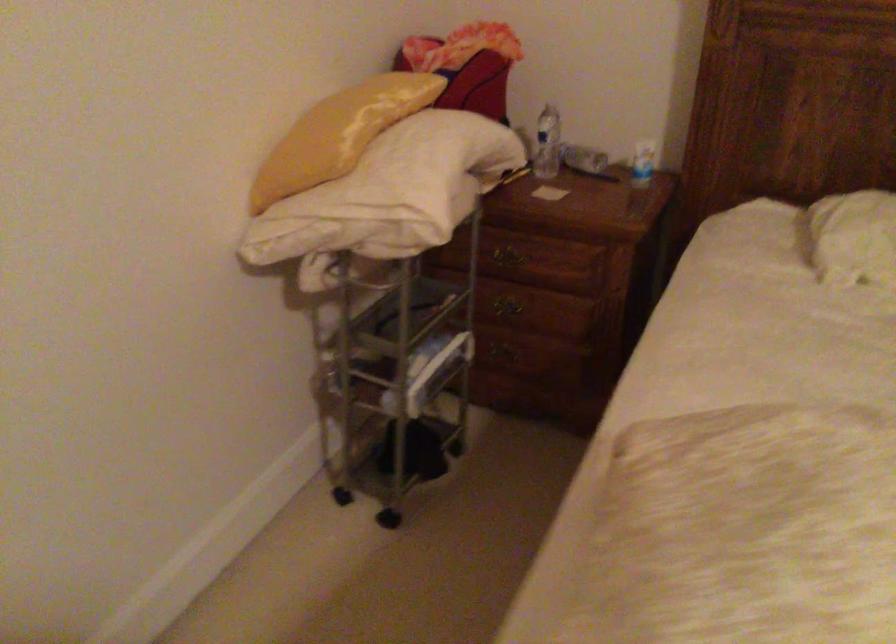
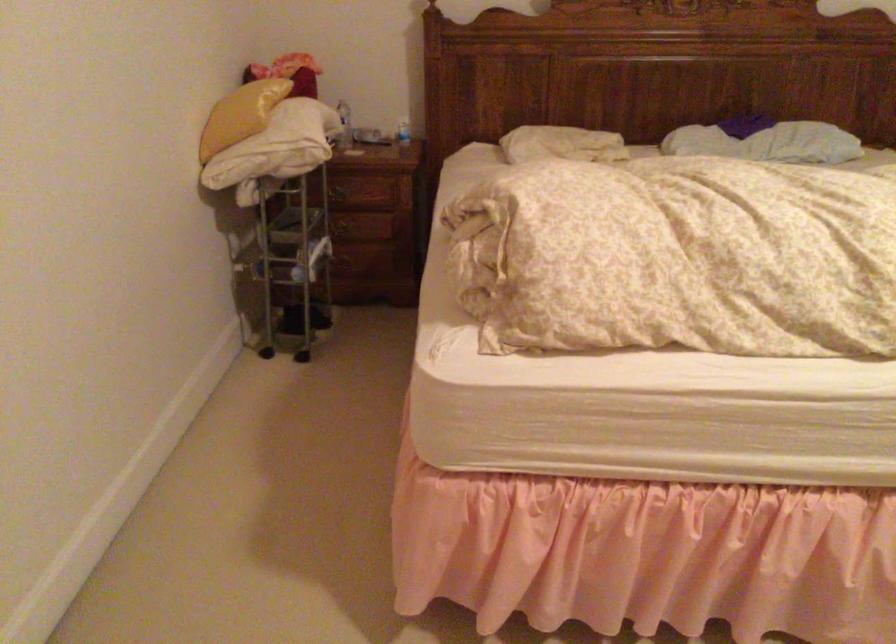
In the second image, find the point that corresponds to [312,143] in the first image.

(240, 115)